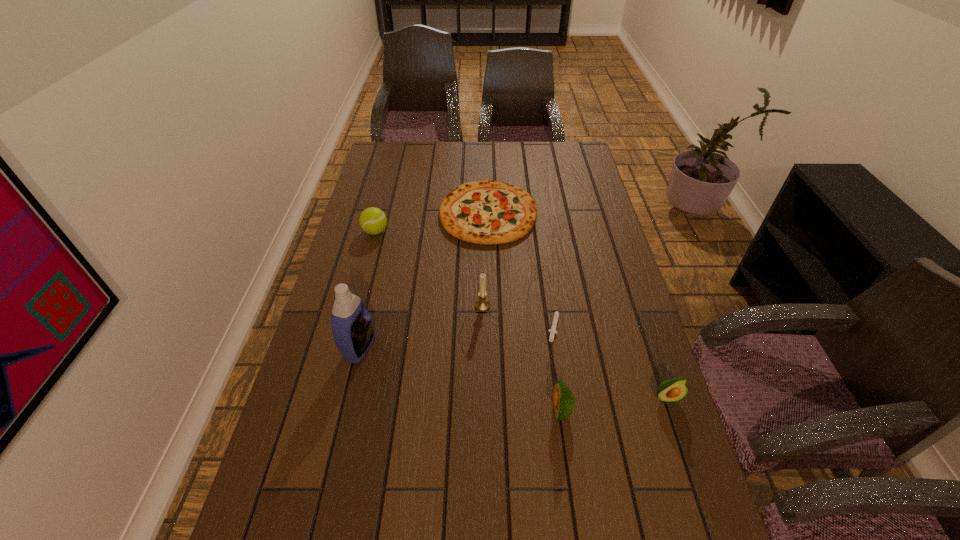
Locate an element on the screen. The width and height of the screenshot is (960, 540). vacant area situated on the cut side of the left avocado is located at coordinates (402, 410).

The image size is (960, 540). Identify the location of free space located 0.100m on the cut side of the shorter avocado. [x=683, y=446].

The height and width of the screenshot is (540, 960). I want to click on vacant area situated 0.190m on the front of the second shortest object, so click(x=491, y=287).

Image resolution: width=960 pixels, height=540 pixels. I want to click on vacant space located on the right of the tennis ball, so click(426, 232).

The height and width of the screenshot is (540, 960). I want to click on blank space located on the left of the detergent, so click(316, 347).

Where is `vacant space located 0.310m on the back of the candle holder`? This screenshot has width=960, height=540. vacant space located 0.310m on the back of the candle holder is located at coordinates (482, 233).

The image size is (960, 540). I want to click on free space located on the front of the shortest object, so click(565, 400).

This screenshot has width=960, height=540. I want to click on tennis ball that is at the left edge, so click(372, 220).

Locate an element on the screen. detergent that is at the left edge is located at coordinates (352, 327).

Where is `object located in the right edge section of the desktop`? The height and width of the screenshot is (540, 960). object located in the right edge section of the desktop is located at coordinates click(x=672, y=390).